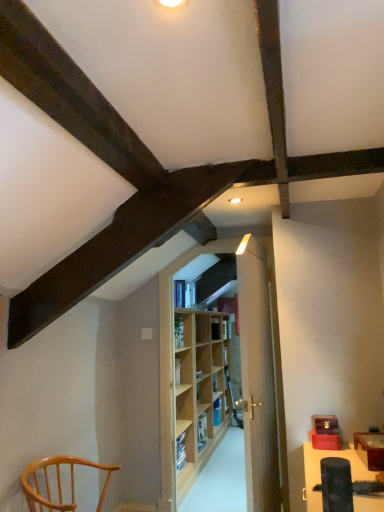
Question: Based on their positions, is matte black speaker at lower right located to the left or right of light brown wood chair at lower left?

Choices:
 (A) right
 (B) left

Answer: (A)

Question: In terms of size, does matte black speaker at lower right appear bigger or smaller than light brown wood chair at lower left?

Choices:
 (A) big
 (B) small

Answer: (A)

Question: Which object is positioned farthest from the light wood door at center?

Choices:
 (A) light brown wood chair at lower left
 (B) black plastic lift at lower right
 (C) light wood shelf at center, positioned as the second shelf in back-to-front order
 (D) matte black speaker at lower right
 (E) wooden bookshelf at center, acting as the 1th shelf starting from the right

Answer: (E)

Question: Which object is positioned farthest from the light wood door at center?

Choices:
 (A) wooden bookshelf at center, acting as the 1th shelf starting from the right
 (B) black plastic lift at lower right
 (C) light wood shelf at center, which is the 1th shelf in left-to-right order
 (D) matte black speaker at lower right
 (E) light brown wood chair at lower left

Answer: (A)